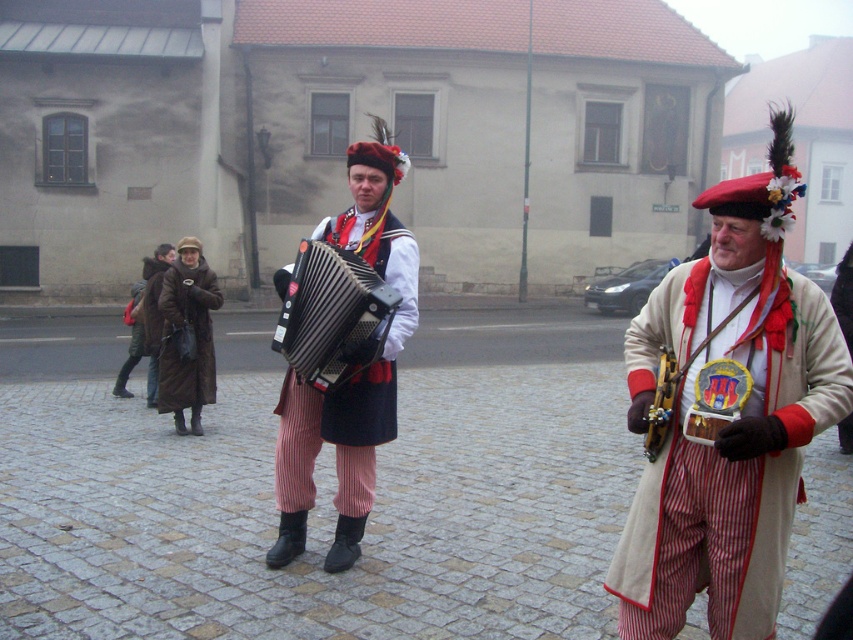
You are a photographer standing in front of the two performers. You want to take a photo where both the black plastic accordion at center and the brown leather coat at center are clearly visible. Since the accordion is closer to you, will you need to adjust your position to ensure the coat is also in focus?

The black plastic accordion at center is closer to the viewer than the brown leather coat at center. To ensure both are in focus, you should adjust your position to create more depth of field or step back to include both objects within the focal range.

You are a photographer standing at the center of the cobblestone street. You want to take a photo of the black plastic accordion at center. Where should you point your camera to capture it in the frame?

The black plastic accordion at center is located at point coordinates 0.492 on the x axis and 0.389 on the y axis, so you should point your camera towards those coordinates to capture it.